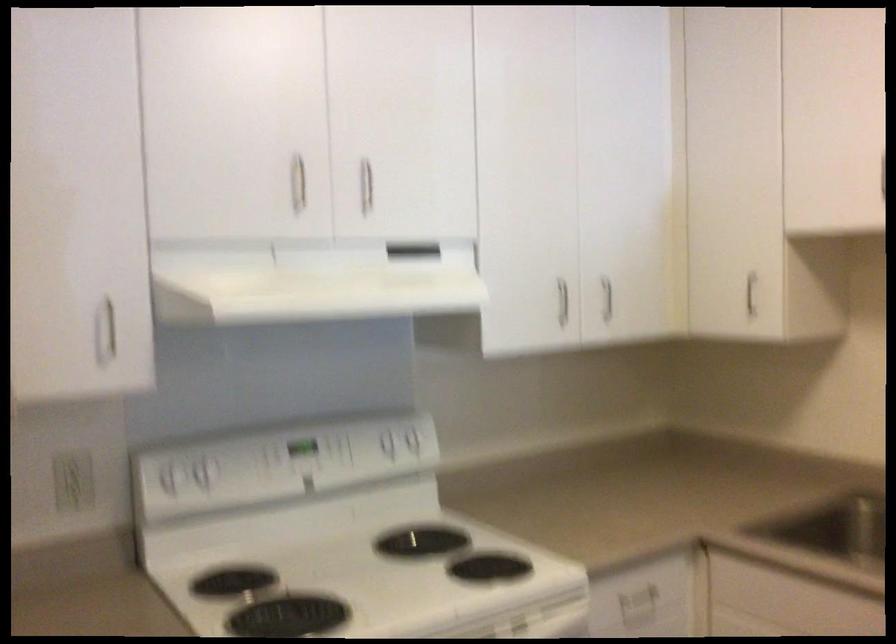
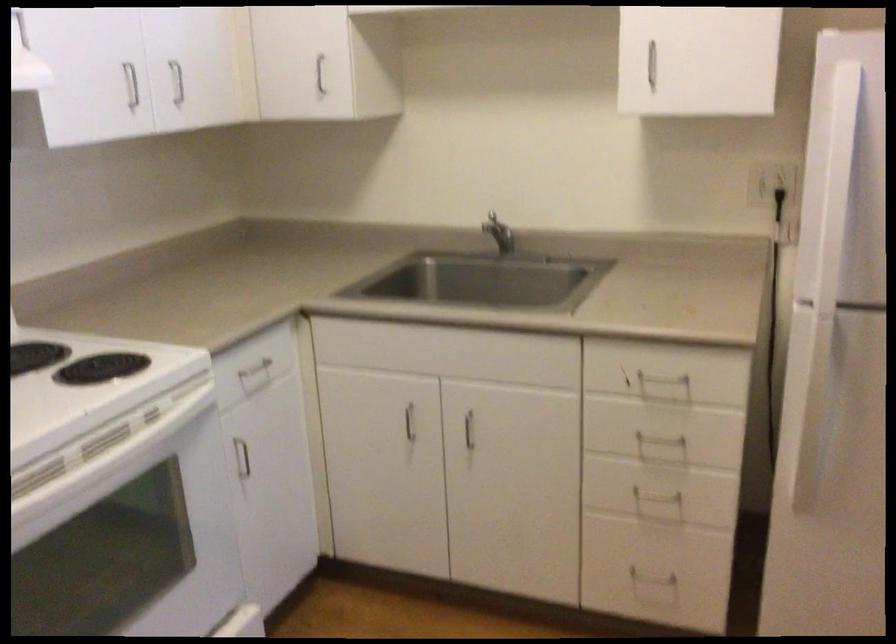
Find the pixel in the second image that matches [755,297] in the first image.

(319, 75)